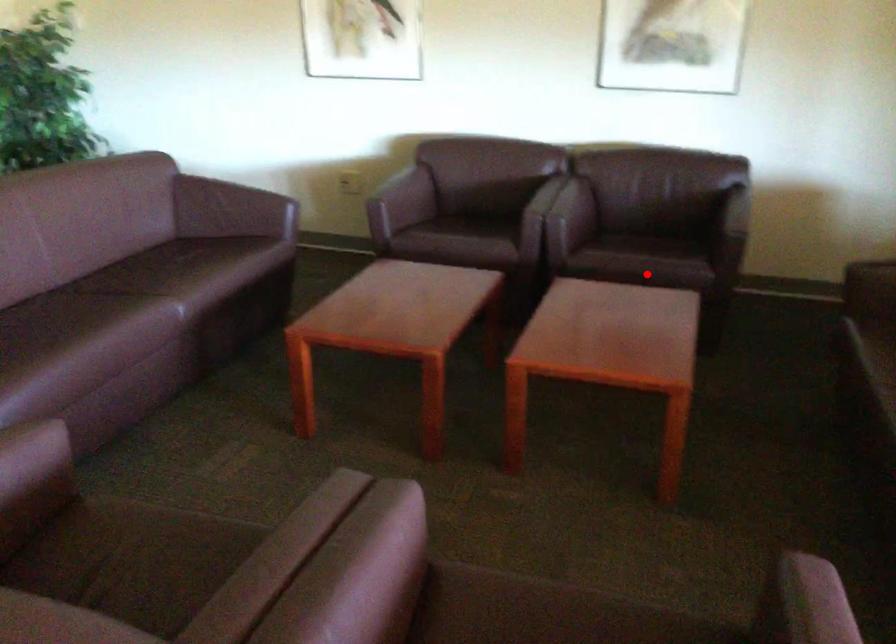
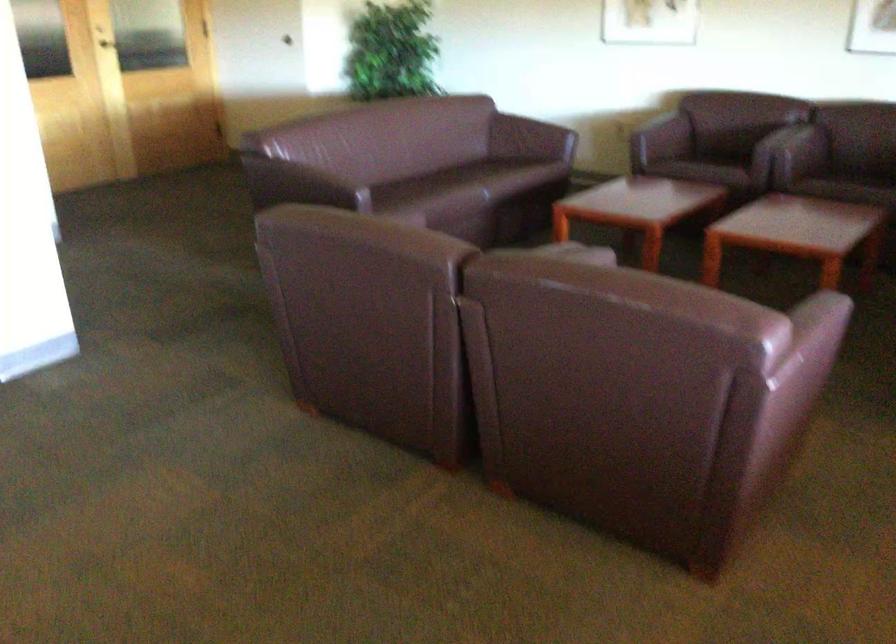
In the second image, find the point that corresponds to the highlighted location in the first image.

(853, 185)